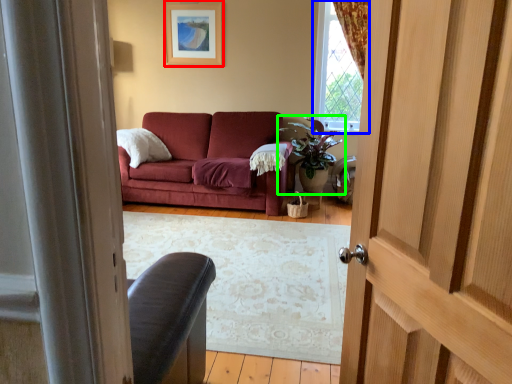
Question: Which object is positioned closest to picture frame (highlighted by a red box)? Select from window (highlighted by a blue box) and houseplant (highlighted by a green box).

Choices:
 (A) window
 (B) houseplant

Answer: (A)